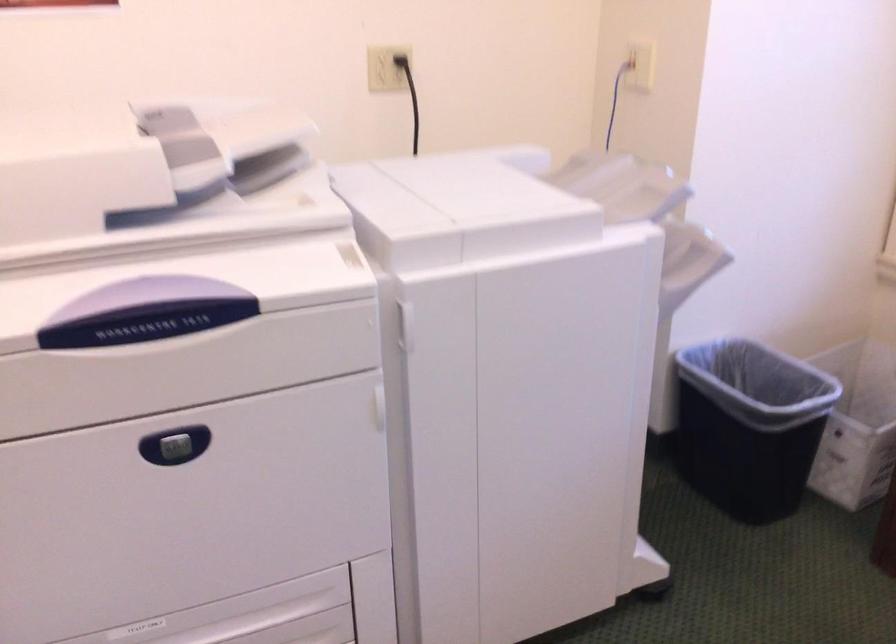
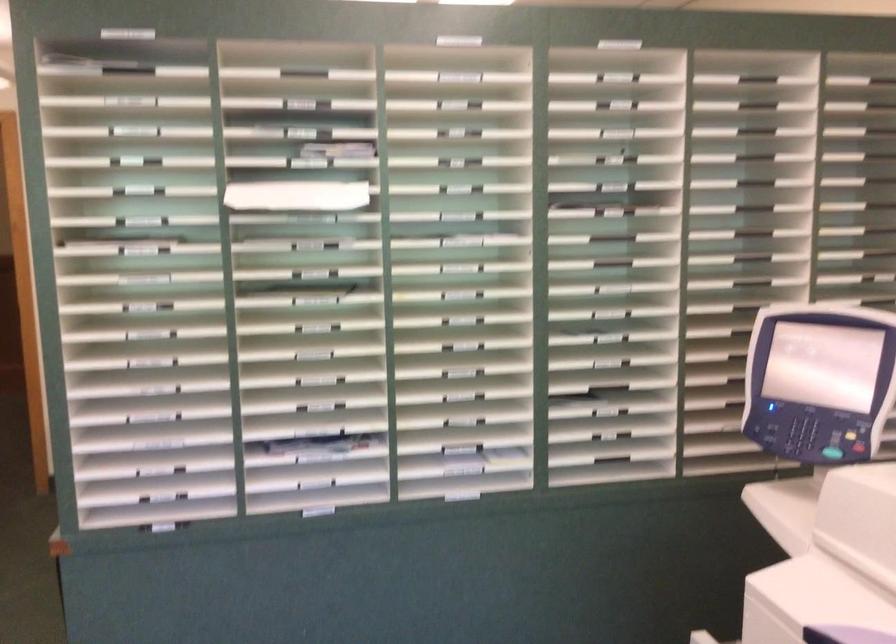
Question: The camera is either moving clockwise (left) or counter-clockwise (right) around the object. The first image is from the beginning of the video and the second image is from the end. Is the camera moving left or right when shooting the video?

Choices:
 (A) Left
 (B) Right

Answer: (B)